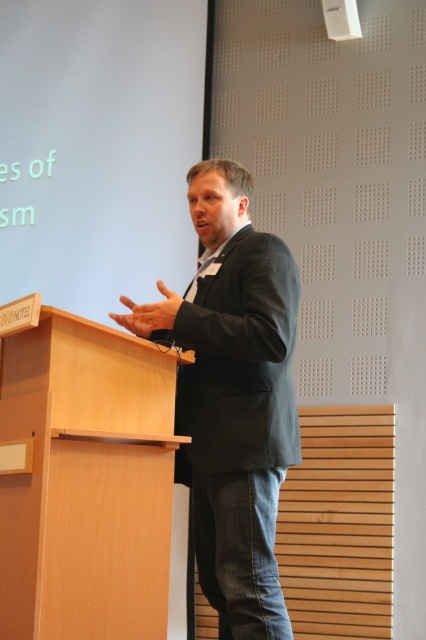
Question: Among these objects, which one is farthest from the camera?

Choices:
 (A) light wood podium at left
 (B) dark gray suit at center

Answer: (B)

Question: Can you confirm if light wood podium at left is positioned to the left of dark gray suit at center?

Choices:
 (A) no
 (B) yes

Answer: (B)

Question: Is the position of light wood podium at left less distant than that of dark gray suit at center?

Choices:
 (A) yes
 (B) no

Answer: (A)

Question: Is light wood podium at left positioned in front of dark gray suit at center?

Choices:
 (A) yes
 (B) no

Answer: (A)

Question: Among these points, which one is farthest from the camera?

Choices:
 (A) (189, 189)
 (B) (43, 564)

Answer: (A)

Question: Which point is farther to the camera?

Choices:
 (A) (212, 577)
 (B) (71, 451)

Answer: (A)